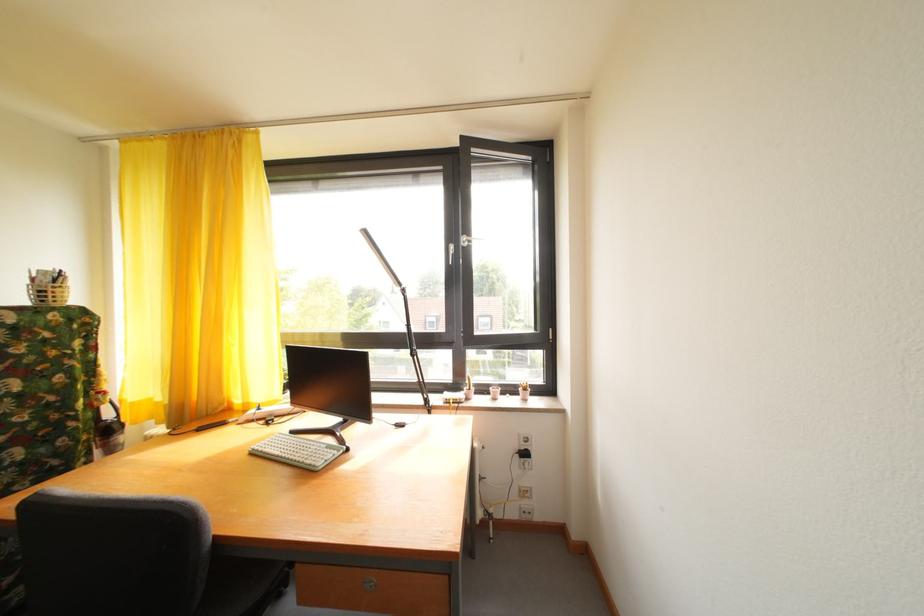
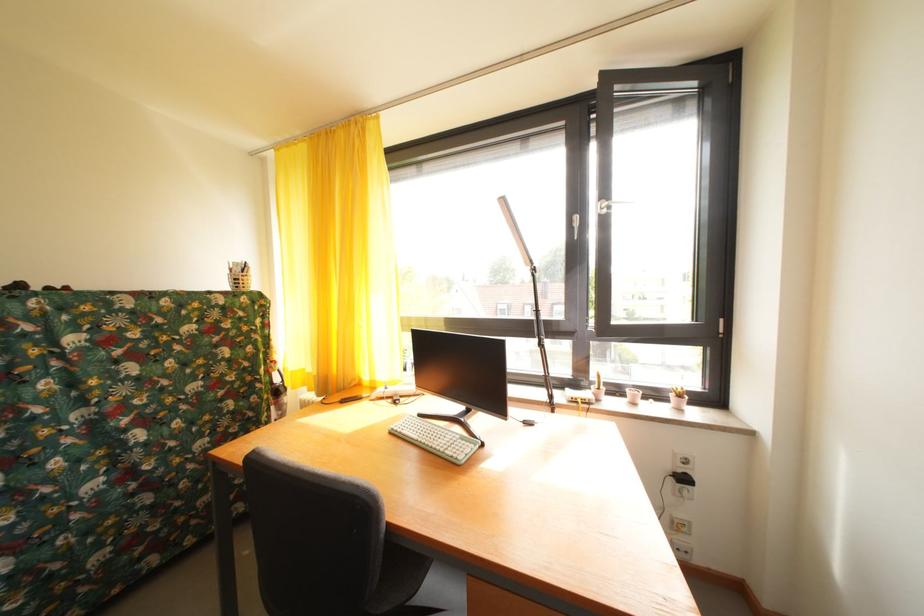
Question: Based on the continuous images, in which direction is the camera rotating? Reply with the corresponding letter.

Choices:
 (A) Left
 (B) Right
 (C) Up
 (D) Down

Answer: (A)